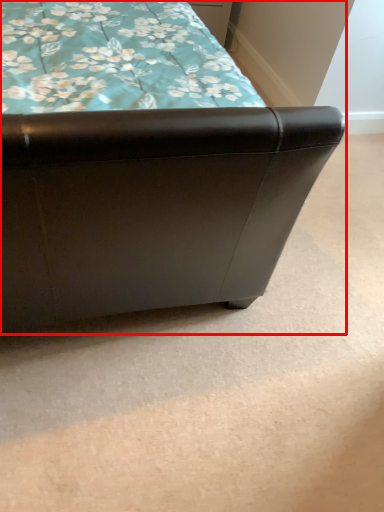
Question: From the image's perspective, what is the correct spatial positioning of furniture (annotated by the red box) in reference to drawer?

Choices:
 (A) above
 (B) below

Answer: (B)